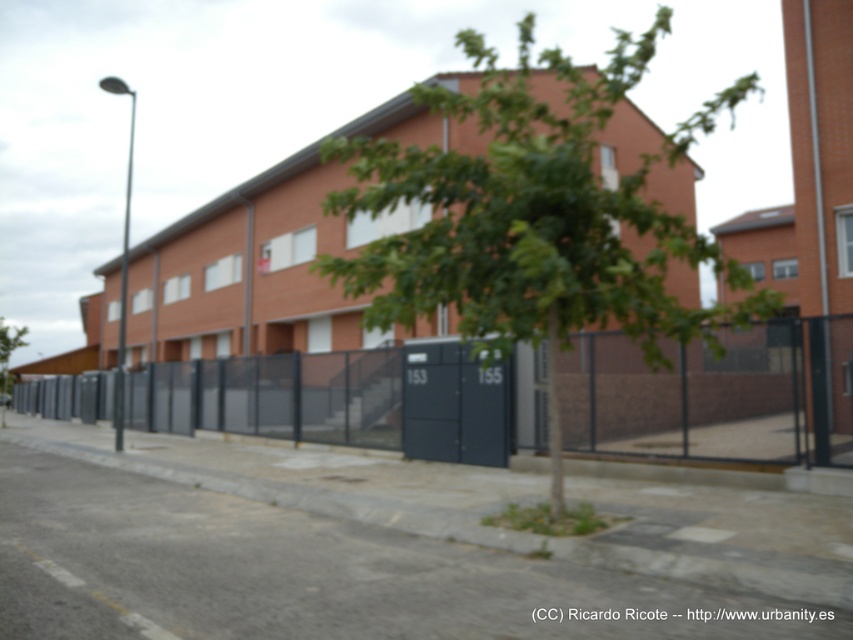
You are standing on the sidewalk looking at the green leafy tree at center and the dark gray metal fence at center. Which object is nearer to you?

The green leafy tree at center is closer to the viewer than the dark gray metal fence at center, so the green leafy tree at center is nearer to you.

You are a pedestrian standing on the sidewalk in front of the building. You want to walk to the tree. Which direction should you turn to reach the green leafy tree at center from the dark gray metal fence at center?

The green leafy tree at center is to the right of the dark gray metal fence at center, so you should turn right to reach it.